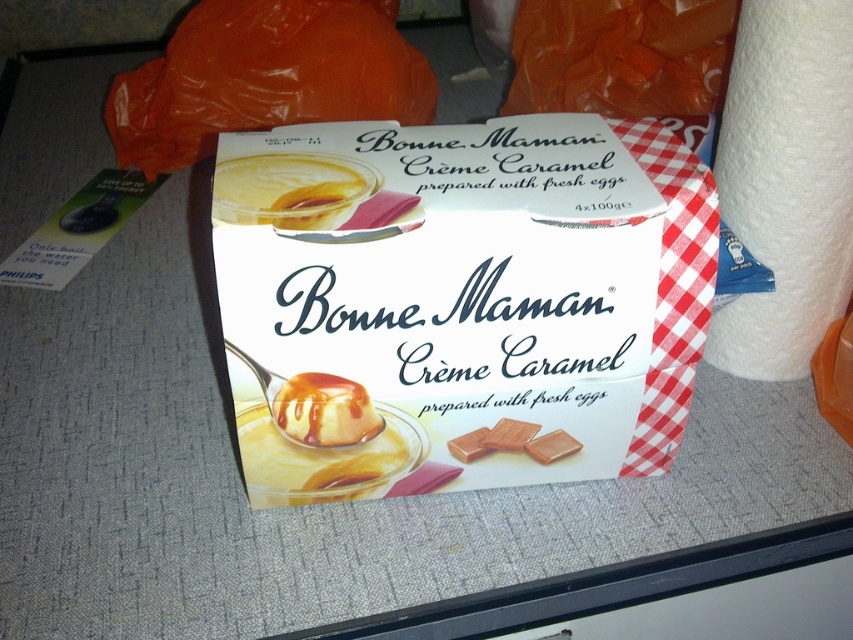
You are standing in front of the kitchen countertop where the Bonne Maman Crme Caramel box is placed. There are two points marked on the box. The first point is at coordinate (788, 45) and the second point is at coordinate (234, 177). From your perspective, which point is closer to you?

Point (234, 177) is closer to you because it is in front of point (788, 45).

You are a customer at a grocery store looking at the Bonne Maman Crme Caramel box. You notice the yellow creamy pudding at center and the white glossy creme caramel at center. Which one is closer to you?

The yellow creamy pudding at center is closer to the viewer than the white glossy creme caramel at center.

You are organizing items on a narrow kitchen shelf that can only accommodate items up to 15 cm in width. You have a white paper towel at right and a white glossy creme caramel at center. Which item should you place on the shelf to ensure it fits?

The white glossy creme caramel at center should be placed on the shelf since its width is narrower than the white paper towel at right, which exceeds the 15 cm limit.